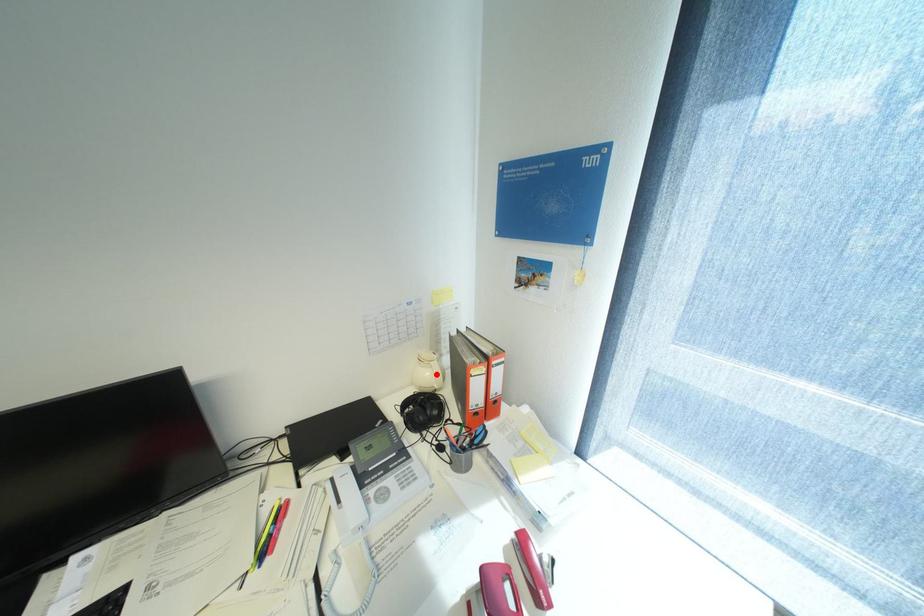
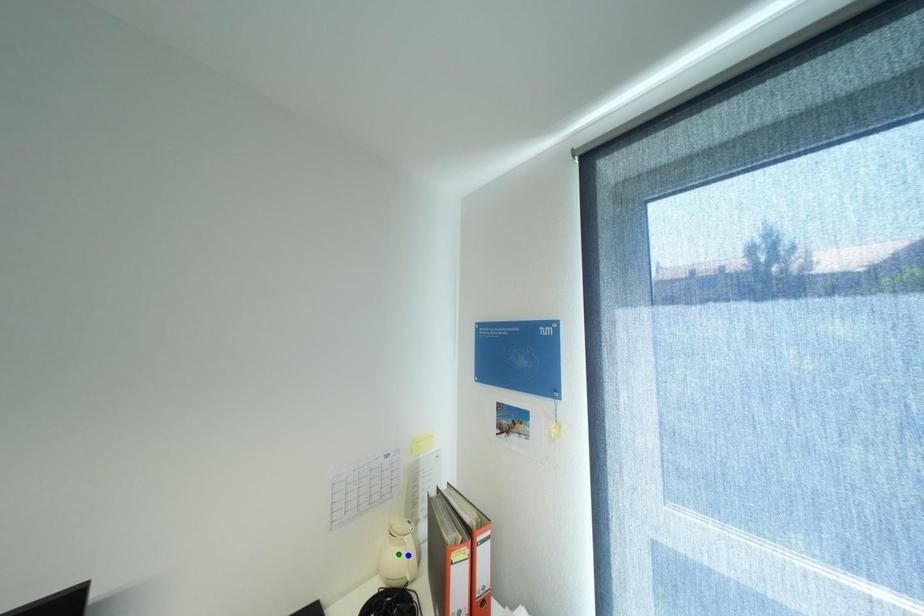
Question: I am providing you with two images of the same scene from different viewpoints. A red point is marked on the first image. You are given multiple points on the second image. In image 2, which mark is for the same physical point as the one in image 1?

Choices:
 (A) blue point
 (B) yellow point
 (C) green point

Answer: (A)